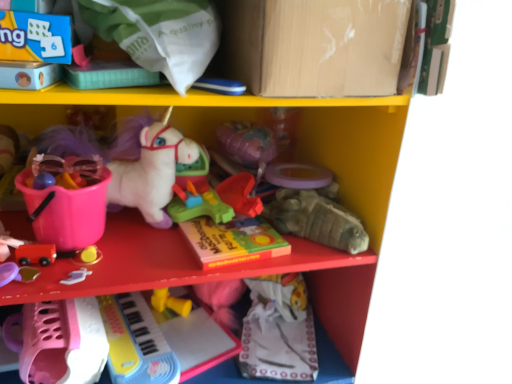
Question: Considering their positions, is rubberized plastic toy at center, which is the second toy from top to bottom, located in front of or behind pink plastic bucket at left?

Choices:
 (A) behind
 (B) front

Answer: (A)

Question: In terms of size, does rubberized plastic toy at center, arranged as the 5th toy when ordered from the bottom, appear bigger or smaller than pink plastic bucket at left?

Choices:
 (A) big
 (B) small

Answer: (B)

Question: Which object is the farthest from the matte cardboard box at upper center?

Choices:
 (A) matte plastic book at center
 (B) rubberized plastic toy at center, arranged as the 5th toy when ordered from the bottom
 (C) matte gray turtle at center right, positioned as the third toy in top-to-bottom order
 (D) plastic yellow keyboard at lower center, the sixth toy from the top
 (E) yellow rubber toy at lower center, which is counted as the 5th toy, starting from the top

Answer: (E)

Question: Which of these objects is positioned farthest from the rubberized plastic toy at center, which is the second toy from top to bottom?

Choices:
 (A) matte gray turtle at center right, positioned as the third toy in top-to-bottom order
 (B) matte cardboard box at upper center
 (C) matte plastic book at center
 (D) smooth wooden car at lower left, which is the third toy from bottom to top
 (E) yellow rubber toy at lower center, which is counted as the 5th toy, starting from the top

Answer: (B)